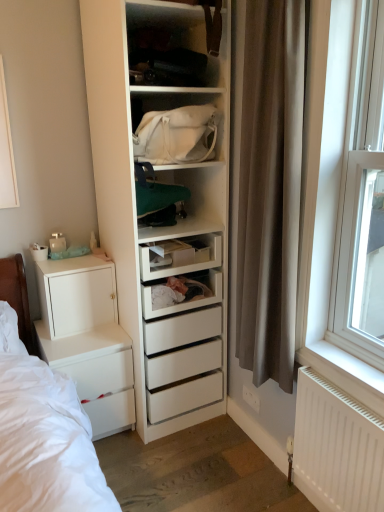
Question: Is brown fabric curtain at right touching white plastic window at right?

Choices:
 (A) no
 (B) yes

Answer: (A)

Question: Is brown fabric curtain at right not near white plastic window at right?

Choices:
 (A) no
 (B) yes

Answer: (A)

Question: From the image's perspective, would you say brown fabric curtain at right is shown under white plastic window at right?

Choices:
 (A) no
 (B) yes

Answer: (A)

Question: Is brown fabric curtain at right aimed at white plastic window at right?

Choices:
 (A) no
 (B) yes

Answer: (A)

Question: Would you say brown fabric curtain at right is outside white plastic window at right?

Choices:
 (A) no
 (B) yes

Answer: (B)

Question: Do you think white matte cabinet at lower left is within matte white shelf at upper center, arranged as the 1th shelf when viewed from the top, or outside of it?

Choices:
 (A) outside
 (B) inside

Answer: (A)

Question: From a real-world perspective, relative to matte white shelf at upper center, arranged as the 1th shelf when viewed from the top, is white matte cabinet at lower left vertically above or below?

Choices:
 (A) above
 (B) below

Answer: (B)

Question: Considering the positions of white matte cabinet at lower left and matte white shelf at upper center, the 2th shelf ordered from the bottom, in the image, is white matte cabinet at lower left taller or shorter than matte white shelf at upper center, the 2th shelf ordered from the bottom,?

Choices:
 (A) tall
 (B) short

Answer: (A)

Question: In terms of width, does white matte cabinet at lower left look wider or thinner when compared to matte white shelf at upper center, the 2th shelf ordered from the bottom?

Choices:
 (A) thin
 (B) wide

Answer: (B)

Question: Is point (193, 161) positioned closer to the camera than point (246, 120)?

Choices:
 (A) farther
 (B) closer

Answer: (A)

Question: From a real-world perspective, is white canvas bag at center, marked as the 2th shelf in a top-to-bottom arrangement, physically located above or below brown fabric curtain at right?

Choices:
 (A) above
 (B) below

Answer: (A)

Question: Based on their sizes in the image, would you say white canvas bag at center, marked as the 2th shelf in a top-to-bottom arrangement, is bigger or smaller than brown fabric curtain at right?

Choices:
 (A) big
 (B) small

Answer: (B)

Question: From their relative heights in the image, would you say white canvas bag at center, the first shelf in the bottom-to-top sequence, is taller or shorter than brown fabric curtain at right?

Choices:
 (A) short
 (B) tall

Answer: (A)

Question: Do you think white matte radiator at lower right is within matte white shelf at upper center, arranged as the 1th shelf when viewed from the top, or outside of it?

Choices:
 (A) outside
 (B) inside

Answer: (A)

Question: Relative to matte white shelf at upper center, arranged as the 1th shelf when viewed from the top, is white matte radiator at lower right in front or behind?

Choices:
 (A) behind
 (B) front

Answer: (B)